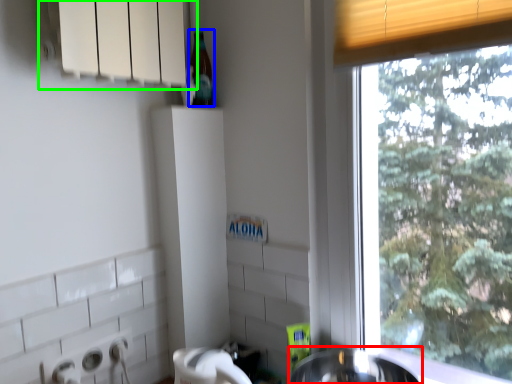
Question: Which object is the farthest from sink (highlighted by a red box)? Choose among these: bottle (highlighted by a blue box) or window sill (highlighted by a green box).

Choices:
 (A) bottle
 (B) window sill

Answer: (B)